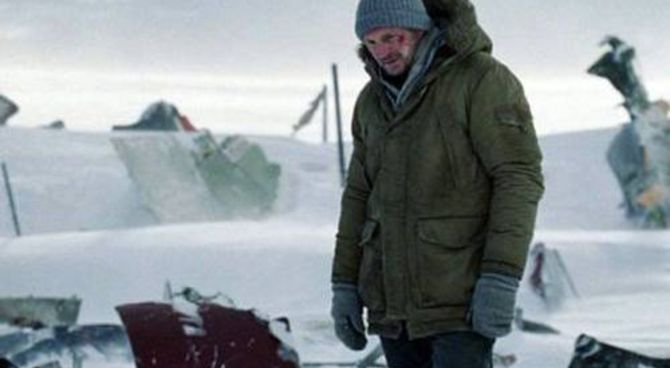
Where is `short wall`? Image resolution: width=670 pixels, height=368 pixels. short wall is located at coordinates (565, 172), (53, 176).